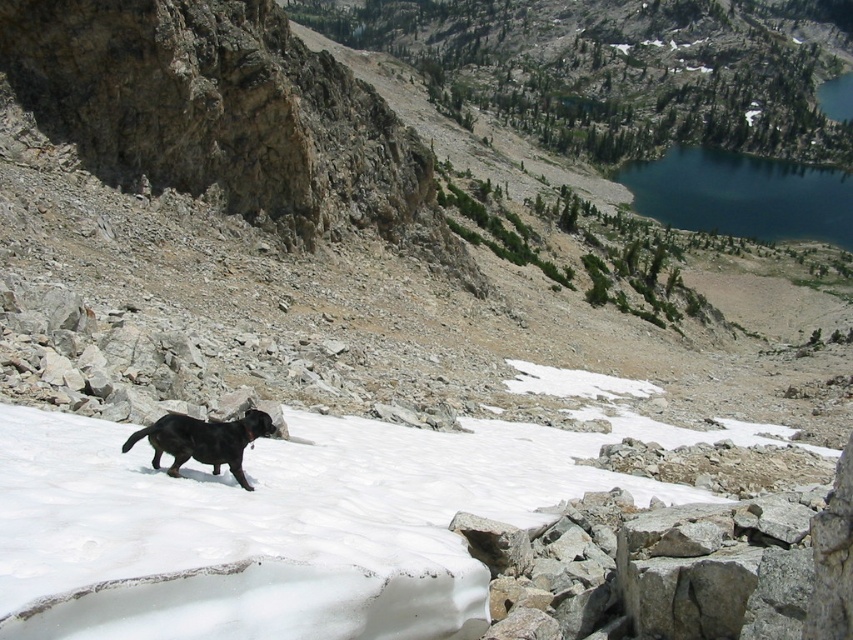
Question: Which of the following is the closest to the observer?

Choices:
 (A) (729, 177)
 (B) (132, 488)

Answer: (B)

Question: Is white powdery snow at center above deep blue water at upper right?

Choices:
 (A) no
 (B) yes

Answer: (A)

Question: Is white powdery snow at center smaller than deep blue water at upper right?

Choices:
 (A) no
 (B) yes

Answer: (B)

Question: Considering the relative positions of white powdery snow at center and deep blue water at upper right in the image provided, where is white powdery snow at center located with respect to deep blue water at upper right?

Choices:
 (A) left
 (B) right

Answer: (A)

Question: Estimate the real-world distances between objects in this image. Which object is farther from the white powdery snow at center?

Choices:
 (A) deep blue water at upper right
 (B) shiny black dog at lower left

Answer: (A)

Question: Which of the following is the closest to the observer?

Choices:
 (A) (178, 444)
 (B) (224, 600)
 (C) (714, 221)

Answer: (B)